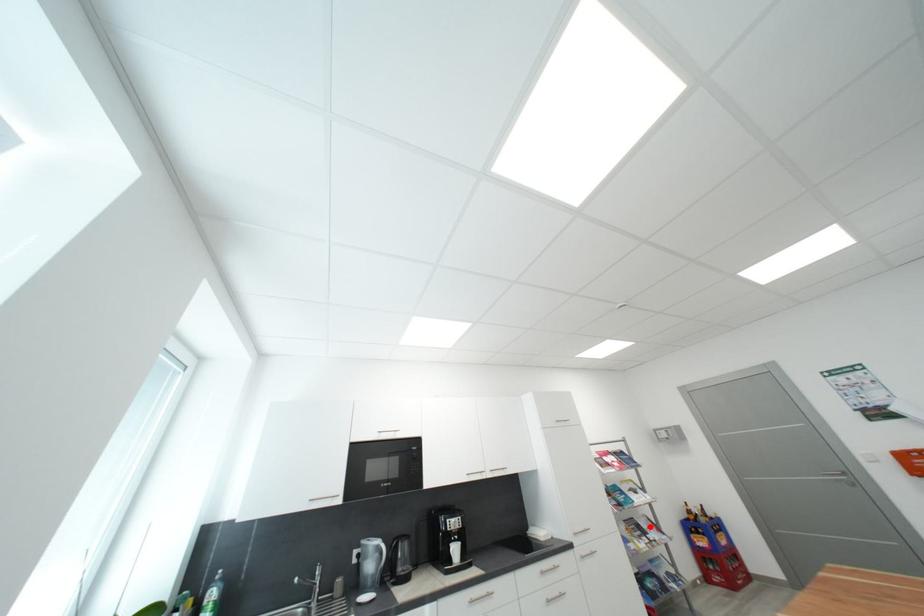
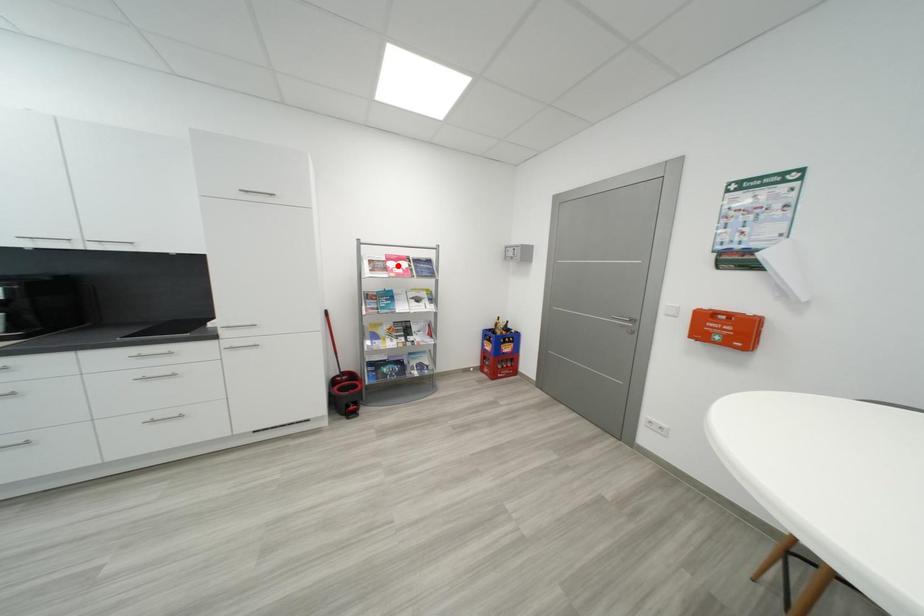
I am providing you with two images of the same scene from different viewpoints. A red point is marked on the first image and another point is marked on the second image. Is the red point in image1 aligned with the point shown in image2?

No